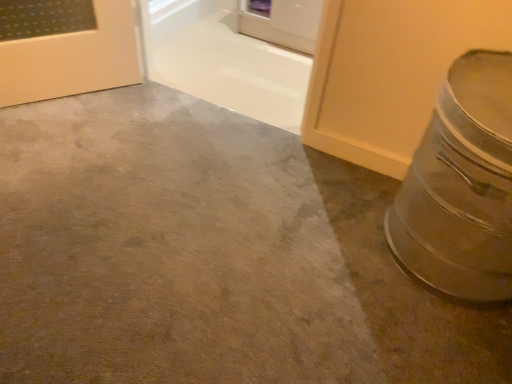
Question: From the image's perspective, is white glossy door at upper center above or below smooth concrete at lower right?

Choices:
 (A) above
 (B) below

Answer: (A)

Question: Is white glossy door at upper center to the left or to the right of smooth concrete at lower right in the image?

Choices:
 (A) right
 (B) left

Answer: (A)

Question: Considering the real-world distances, which object is closest to the white glossy door at upper center?

Choices:
 (A) smooth concrete at lower right
 (B) silver metallic crock pot at right

Answer: (A)

Question: Considering the real-world distances, which object is closest to the silver metallic crock pot at right?

Choices:
 (A) white glossy door at upper center
 (B) smooth concrete at lower right

Answer: (B)